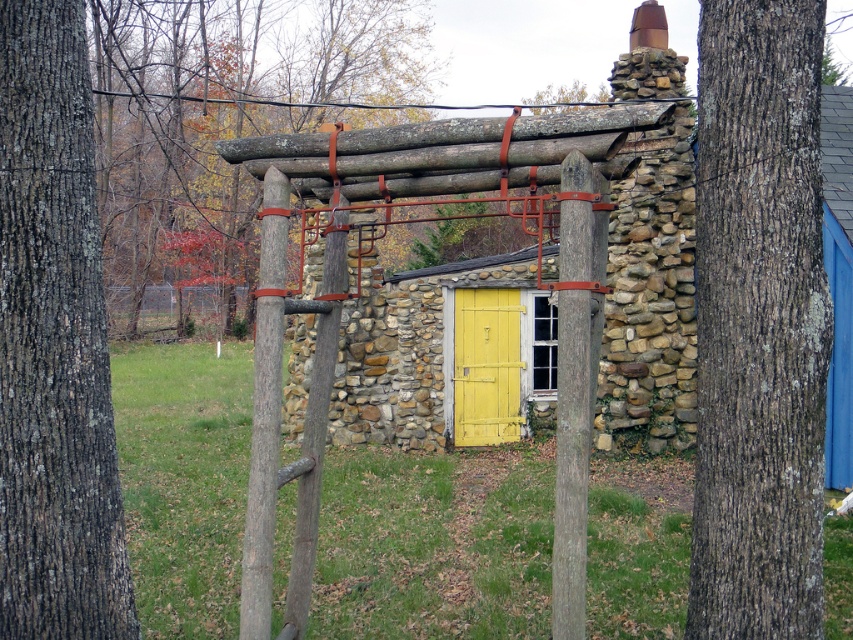
Question: Among these points, which one is farthest from the camera?

Choices:
 (A) (303, 508)
 (B) (247, 499)
 (C) (555, 515)

Answer: (B)

Question: Is brown rough bark tree trunk at right above brown rough wood at center?

Choices:
 (A) no
 (B) yes

Answer: (A)

Question: Is smooth brown wooden post at center in front of brown wood pole at center?

Choices:
 (A) no
 (B) yes

Answer: (B)

Question: Does smooth brown wooden post at center appear over smooth wood pole at center?

Choices:
 (A) yes
 (B) no

Answer: (A)

Question: Which point is closer to the camera?

Choices:
 (A) (590, 252)
 (B) (262, 358)
 (C) (799, 554)

Answer: (A)

Question: Based on their relative distances, which object is farther from the dark brown bark at left?

Choices:
 (A) brown rough bark tree trunk at right
 (B) brown wood pole at center

Answer: (A)